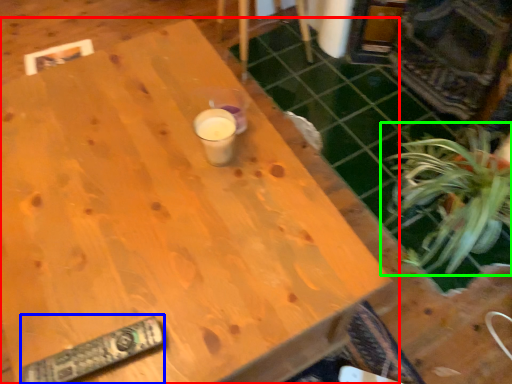
Question: Which is nearer to the table (highlighted by a red box)? remote (highlighted by a blue box) or houseplant (highlighted by a green box).

Choices:
 (A) remote
 (B) houseplant

Answer: (A)